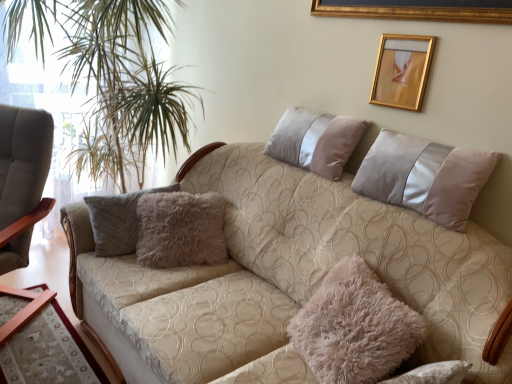
Question: Is the depth of silky beige pillow at upper right, the 2th pillow in the bottom-to-top sequence, greater than that of green leafy plant at left?

Choices:
 (A) yes
 (B) no

Answer: (B)

Question: Does silky beige pillow at upper right, positioned as the 1th pillow in top-to-bottom order, have a smaller size compared to green leafy plant at left?

Choices:
 (A) no
 (B) yes

Answer: (B)

Question: Considering the relative positions of silky beige pillow at upper right, positioned as the 1th pillow in top-to-bottom order, and green leafy plant at left in the image provided, is silky beige pillow at upper right, positioned as the 1th pillow in top-to-bottom order, to the left of green leafy plant at left from the viewer's perspective?

Choices:
 (A) no
 (B) yes

Answer: (A)

Question: Can you confirm if silky beige pillow at upper right, positioned as the 1th pillow in top-to-bottom order, is taller than green leafy plant at left?

Choices:
 (A) yes
 (B) no

Answer: (B)

Question: Is silky beige pillow at upper right, positioned as the 1th pillow in top-to-bottom order, bigger than green leafy plant at left?

Choices:
 (A) yes
 (B) no

Answer: (B)

Question: From a real-world perspective, relative to green leafy plant at left, is silky beige pillow at upper right, positioned as the 1th pillow in top-to-bottom order, vertically above or below?

Choices:
 (A) above
 (B) below

Answer: (A)

Question: From the image's perspective, is silky beige pillow at upper right, the 2th pillow in the bottom-to-top sequence, located above or below green leafy plant at left?

Choices:
 (A) above
 (B) below

Answer: (B)

Question: From their relative heights in the image, would you say silky beige pillow at upper right, the 2th pillow in the bottom-to-top sequence, is taller or shorter than green leafy plant at left?

Choices:
 (A) short
 (B) tall

Answer: (A)

Question: Is silky beige pillow at upper right, the 2th pillow in the bottom-to-top sequence, in front of or behind green leafy plant at left in the image?

Choices:
 (A) front
 (B) behind

Answer: (A)

Question: Do you think beige fabric couch at center is within silky beige pillow at upper right, positioned as the 1th pillow in top-to-bottom order, or outside of it?

Choices:
 (A) outside
 (B) inside

Answer: (A)

Question: From a real-world perspective, is beige fabric couch at center physically located above or below silky beige pillow at upper right, positioned as the 1th pillow in top-to-bottom order?

Choices:
 (A) below
 (B) above

Answer: (A)

Question: Considering the relative positions of beige fabric couch at center and silky beige pillow at upper right, the 2th pillow in the bottom-to-top sequence, in the image provided, is beige fabric couch at center to the left or to the right of silky beige pillow at upper right, the 2th pillow in the bottom-to-top sequence,?

Choices:
 (A) right
 (B) left

Answer: (B)

Question: From the image's perspective, is beige fabric couch at center above or below silky beige pillow at upper right, the 2th pillow in the bottom-to-top sequence?

Choices:
 (A) below
 (B) above

Answer: (A)

Question: Is point (220, 289) positioned closer to the camera than point (382, 72)?

Choices:
 (A) closer
 (B) farther

Answer: (B)

Question: Is beige fabric couch at center wider or thinner than gold metallic picture frame at upper right?

Choices:
 (A) thin
 (B) wide

Answer: (B)